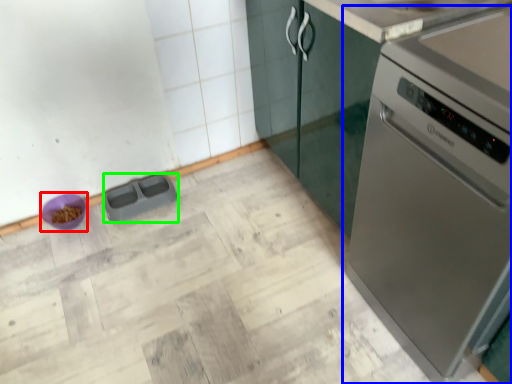
Question: Which is farther away from appliance (highlighted by a red box)? home appliance (highlighted by a blue box) or appliance (highlighted by a green box)?

Choices:
 (A) home appliance
 (B) appliance

Answer: (A)